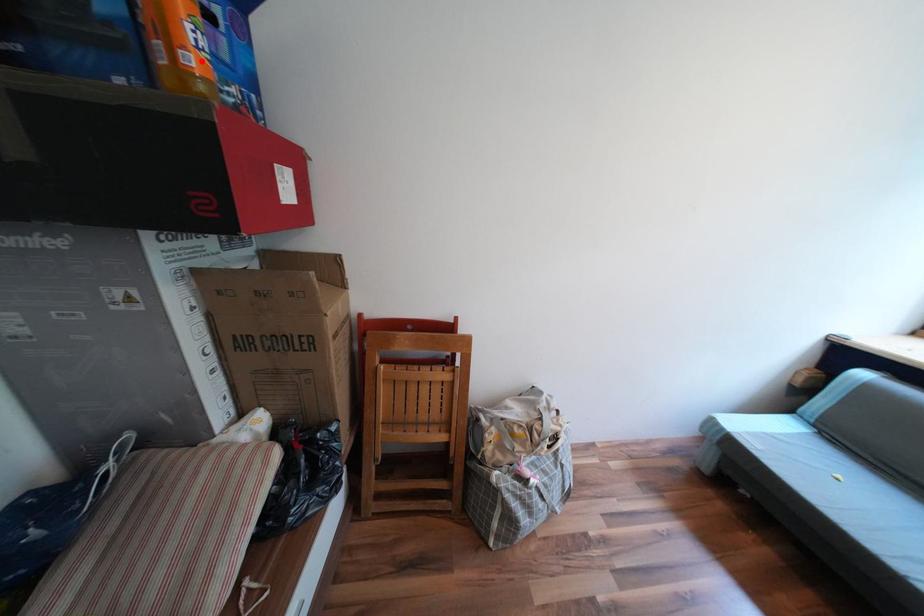
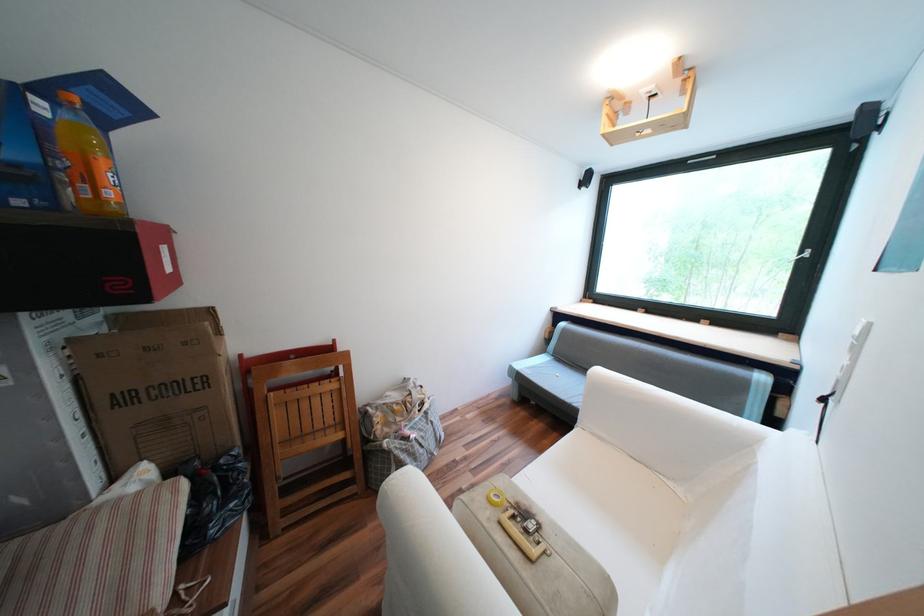
Where in the second image is the point corresponding to the highlighted location from the first image?

(118, 193)